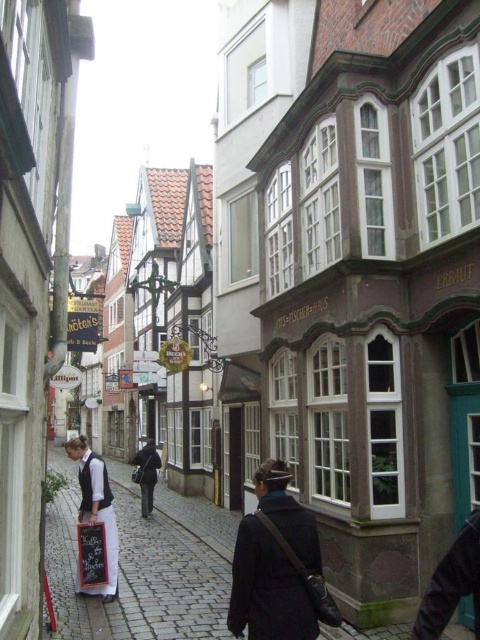
Is white linen apron at lower left thinner than dark gray coat at center?

Indeed, white linen apron at lower left has a lesser width compared to dark gray coat at center.

Which is more to the right, white linen apron at lower left or dark gray coat at center?

Positioned to the right is white linen apron at lower left.

Where is `white linen apron at lower left`? Image resolution: width=480 pixels, height=640 pixels. white linen apron at lower left is located at coordinates (96, 512).

Is dark blue coat at center to the left of white linen apron at lower left from the viewer's perspective?

In fact, dark blue coat at center is to the right of white linen apron at lower left.

Does dark blue coat at center appear over white linen apron at lower left?

Correct, dark blue coat at center is located above white linen apron at lower left.

Which is in front, point (243, 577) or point (117, 561)?

Point (243, 577) is in front.

Find the location of a particular element. The width and height of the screenshot is (480, 640). dark blue coat at center is located at coordinates (266, 588).

Does point (263, 600) come closer to viewer compared to point (136, 477)?

Yes, it is in front of point (136, 477).

Who is positioned more to the left, dark blue coat at center or dark gray coat at center?

dark gray coat at center

What do you see at coordinates (266, 588) in the screenshot? The width and height of the screenshot is (480, 640). I see `dark blue coat at center` at bounding box center [266, 588].

Where is `dark blue coat at center`? The width and height of the screenshot is (480, 640). dark blue coat at center is located at coordinates (266, 588).